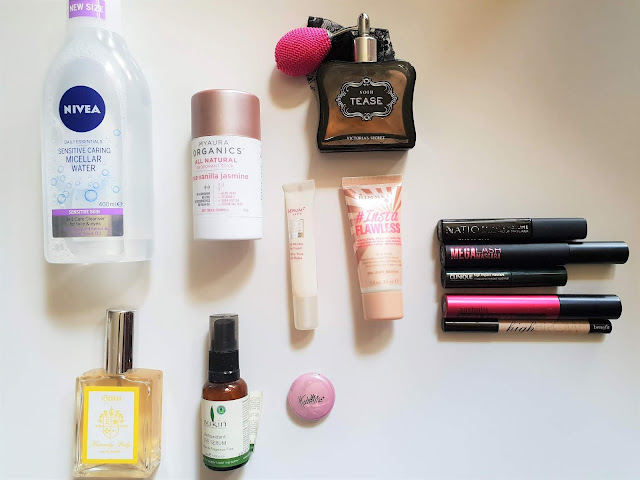
You are a GUI agent. You are given a task and a screenshot of the screen. Output one action in this format:
    pyautogui.click(x=<x>, y=<y>)
    Task: Click on the glass
    The image size is (640, 480).
    Given the screenshot: What is the action you would take?
    [x=144, y=389]